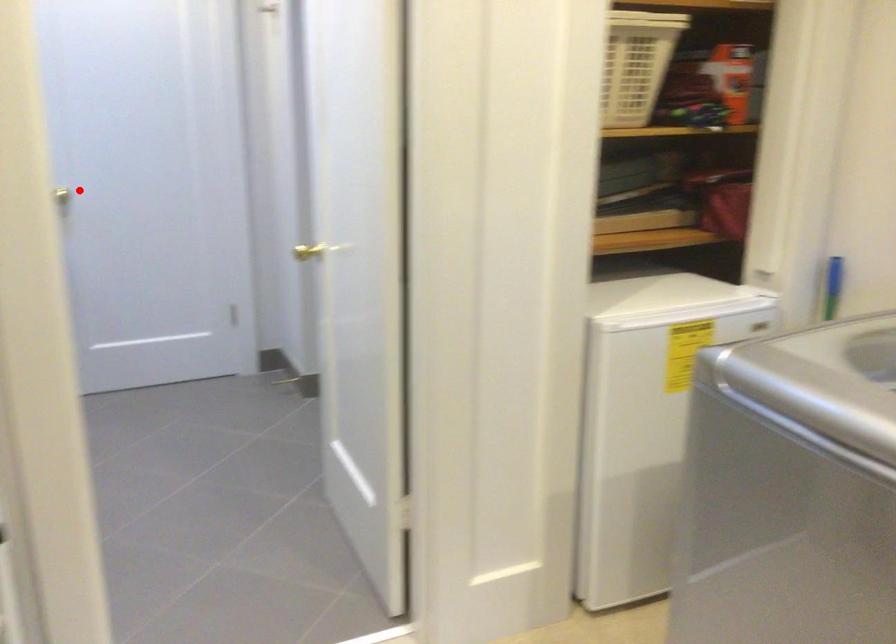
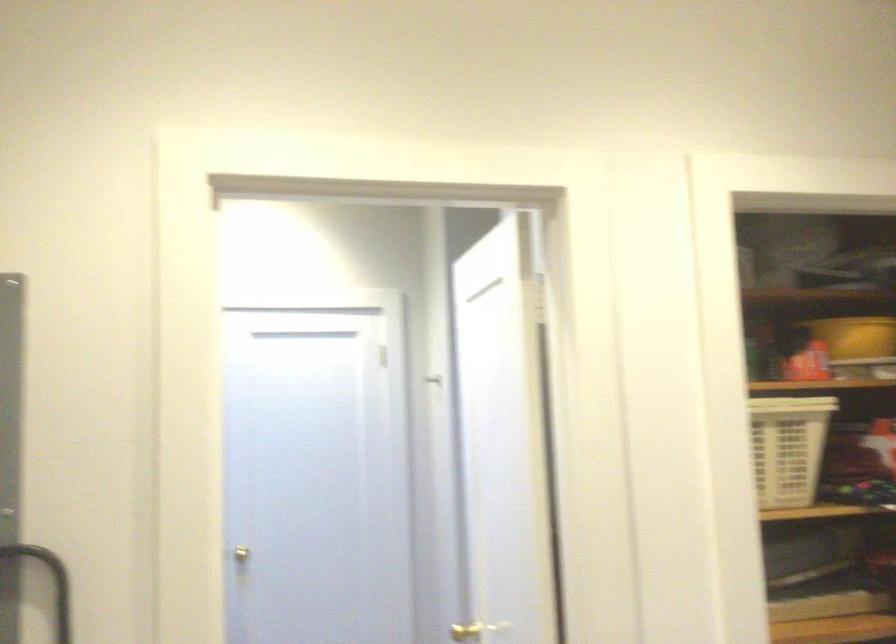
In the second image, find the point that corresponds to the highlighted location in the first image.

(253, 553)